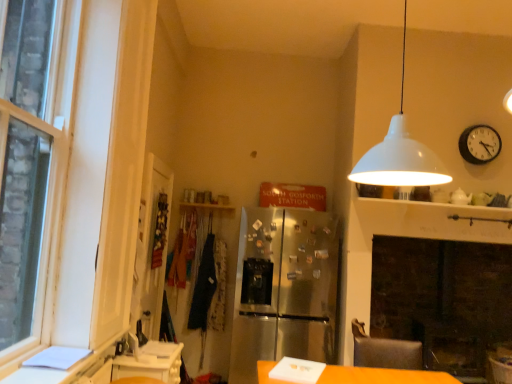
The image size is (512, 384). Describe the element at coordinates (152, 246) in the screenshot. I see `clear glass door at left` at that location.

Describe the element at coordinates (284, 289) in the screenshot. I see `stainless steel refrigerator at center` at that location.

This screenshot has width=512, height=384. What do you see at coordinates (384, 351) in the screenshot?
I see `leather-like swivel chair at lower right` at bounding box center [384, 351].

Locate an element on the screen. The height and width of the screenshot is (384, 512). leather-like swivel chair at lower right is located at coordinates (384, 351).

This screenshot has height=384, width=512. What do you see at coordinates (400, 153) in the screenshot?
I see `white matte lampshade at upper right` at bounding box center [400, 153].

Find the location of `black matte clock at upper right`. black matte clock at upper right is located at coordinates (479, 144).

Identify the location of clear glass door at left. (152, 246).

Where is `laundry on the left side of black matte clock at upper right`? The height and width of the screenshot is (384, 512). laundry on the left side of black matte clock at upper right is located at coordinates (208, 301).

Is point (209, 363) closer to camera compared to point (460, 139)?

No.

Looking at this image, does dark blue fabric at center touch black matte clock at upper right?

No, dark blue fabric at center is not beside black matte clock at upper right.

From a real-world perspective, is white matte lampshade at upper right physically located above or below black matte clock at upper right?

white matte lampshade at upper right is below black matte clock at upper right.

From the picture: Does white matte lampshade at upper right have a lesser width compared to black matte clock at upper right?

Incorrect, the width of white matte lampshade at upper right is not less than that of black matte clock at upper right.

Is white matte lampshade at upper right positioned behind black matte clock at upper right?

No, it is in front of black matte clock at upper right.

Between white matte lampshade at upper right and black matte clock at upper right, which one has less height?

With less height is black matte clock at upper right.

Find the location of a particular element. This screenshot has height=384, width=512. fridge to the left of black matte clock at upper right is located at coordinates point(284,289).

Consider the image. From the image's perspective, is stainless steel refrigerator at center under black matte clock at upper right?

Yes, from the image's perspective, stainless steel refrigerator at center is beneath black matte clock at upper right.

In terms of height, does stainless steel refrigerator at center look taller or shorter compared to black matte clock at upper right?

In the image, stainless steel refrigerator at center appears to be taller than black matte clock at upper right.

From the picture: Considering the relative sizes of stainless steel refrigerator at center and black matte clock at upper right in the image provided, is stainless steel refrigerator at center thinner than black matte clock at upper right?

No, stainless steel refrigerator at center is not thinner than black matte clock at upper right.

From a real-world perspective, relative to dark blue fabric at center, is white matte lampshade at upper right vertically above or below?

white matte lampshade at upper right is above dark blue fabric at center.

What are the coordinates of `lamp on the right of dark blue fabric at center` in the screenshot? It's located at point(400,153).

Is the surface of white matte lampshade at upper right in direct contact with dark blue fabric at center?

No, white matte lampshade at upper right is not in contact with dark blue fabric at center.

Is white matte lampshade at upper right positioned beyond the bounds of dark blue fabric at center?

Indeed, white matte lampshade at upper right is completely outside dark blue fabric at center.

Is dark blue fabric at center wider or thinner than white matte lampshade at upper right?

Considering their sizes, dark blue fabric at center looks slimmer than white matte lampshade at upper right.

Considering the sizes of objects dark blue fabric at center and white matte lampshade at upper right in the image provided, who is bigger, dark blue fabric at center or white matte lampshade at upper right?

dark blue fabric at center is bigger.

Is dark blue fabric at center not close to white matte lampshade at upper right?

Yes, dark blue fabric at center is far from white matte lampshade at upper right.

Measure the distance from dark blue fabric at center to white matte lampshade at upper right.

3.09 meters.

Are white matte lampshade at upper right and leather-like swivel chair at lower right far apart?

Indeed, white matte lampshade at upper right is not near leather-like swivel chair at lower right.

Can you confirm if white matte lampshade at upper right is shorter than leather-like swivel chair at lower right?

No, white matte lampshade at upper right is not shorter than leather-like swivel chair at lower right.

Based on the photo, based on their sizes in the image, would you say white matte lampshade at upper right is bigger or smaller than leather-like swivel chair at lower right?

In the image, white matte lampshade at upper right appears to be larger than leather-like swivel chair at lower right.

From a real-world perspective, does white matte lampshade at upper right stand above leather-like swivel chair at lower right?

Yes, from a real-world perspective, white matte lampshade at upper right is above leather-like swivel chair at lower right.

Is point (218, 281) behind point (270, 333)?

Yes, point (218, 281) is farther from viewer.

Is dark blue fabric at center positioned beyond the bounds of stainless steel refrigerator at center?

Indeed, dark blue fabric at center is completely outside stainless steel refrigerator at center.

Can you tell me how much dark blue fabric at center and stainless steel refrigerator at center differ in facing direction?

0.478 degrees separate the facing orientations of dark blue fabric at center and stainless steel refrigerator at center.

At what (x,y) coordinates should I click in order to perform the action: click on fridge above the dark blue fabric at center (from a real-world perspective). Please return your answer as a coordinate pair (x, y). The height and width of the screenshot is (384, 512). Looking at the image, I should click on (284, 289).

I want to click on laundry on the left of black matte clock at upper right, so click(208, 301).

Locate an element on the screen. The width and height of the screenshot is (512, 384). clock on the right of the white matte lampshade at upper right is located at coordinates (479, 144).

Looking at the image, which one is located further to stainless steel refrigerator at center, dark blue fabric at center or white matte lampshade at upper right?

white matte lampshade at upper right.

Considering their positions, is black matte clock at upper right positioned closer to white matte lampshade at upper right than clear glass door at left?

Based on the image, black matte clock at upper right appears to be nearer to white matte lampshade at upper right.

Looking at the image, which one is located further to black matte clock at upper right, white glossy counter at lower left or leather-like swivel chair at lower right?

Based on the image, white glossy counter at lower left appears to be further to black matte clock at upper right.

Considering their positions, is dark blue fabric at center positioned further to leather-like swivel chair at lower right than black matte clock at upper right?

dark blue fabric at center is positioned further to the anchor leather-like swivel chair at lower right.

From the image, which object appears to be nearer to stainless steel refrigerator at center, white matte lampshade at upper right or leather-like swivel chair at lower right?

leather-like swivel chair at lower right.

Based on their spatial positions, is white glossy counter at lower left or white matte lampshade at upper right further from black matte clock at upper right?

white glossy counter at lower left is further to black matte clock at upper right.

Which object lies nearer to the anchor point clear glass door at left, black matte clock at upper right or leather-like swivel chair at lower right?

leather-like swivel chair at lower right is positioned closer to the anchor clear glass door at left.

Considering their positions, is black matte clock at upper right positioned further to white glossy counter at lower left than leather-like swivel chair at lower right?

black matte clock at upper right lies further to white glossy counter at lower left than the other object.

The width and height of the screenshot is (512, 384). In order to click on fridge between clear glass door at left and leather-like swivel chair at lower right in this screenshot , I will do `click(284, 289)`.

Find the location of `glass door between white matte lampshade at upper right and stainless steel refrigerator at center along the z-axis`. glass door between white matte lampshade at upper right and stainless steel refrigerator at center along the z-axis is located at coordinates (152, 246).

This screenshot has height=384, width=512. Identify the location of fridge positioned between white matte lampshade at upper right and black matte clock at upper right from near to far. (284, 289).

At what (x,y) coordinates should I click in order to perform the action: click on counter between white matte lampshade at upper right and leather-like swivel chair at lower right in the vertical direction. Please return your answer as a coordinate pair (x, y). The height and width of the screenshot is (384, 512). Looking at the image, I should click on tap(151, 362).